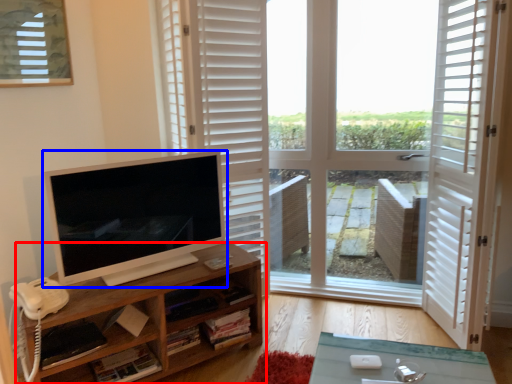
Question: Among these objects, which one is nearest to the camera, shelf (highlighted by a red box) or computer monitor (highlighted by a blue box)?

Choices:
 (A) shelf
 (B) computer monitor

Answer: (A)